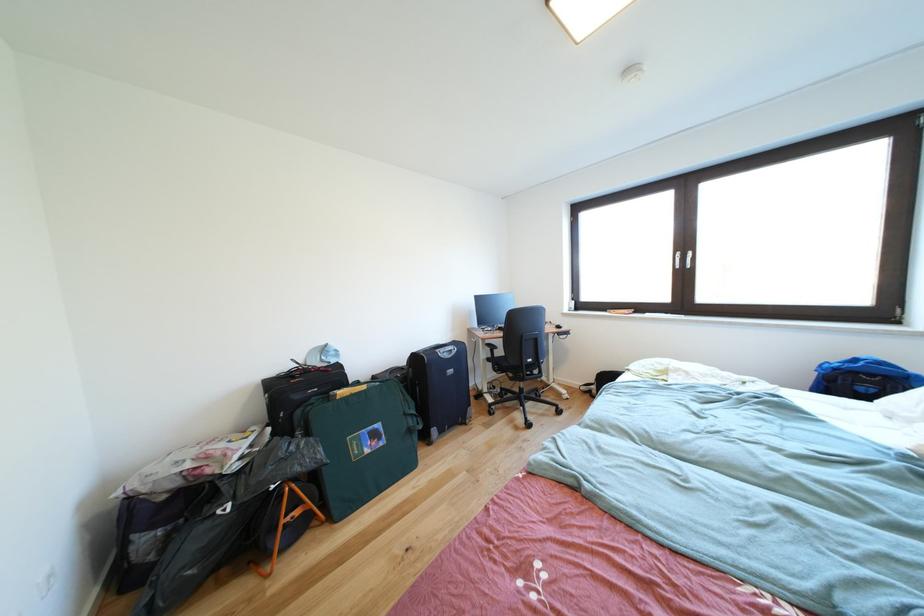
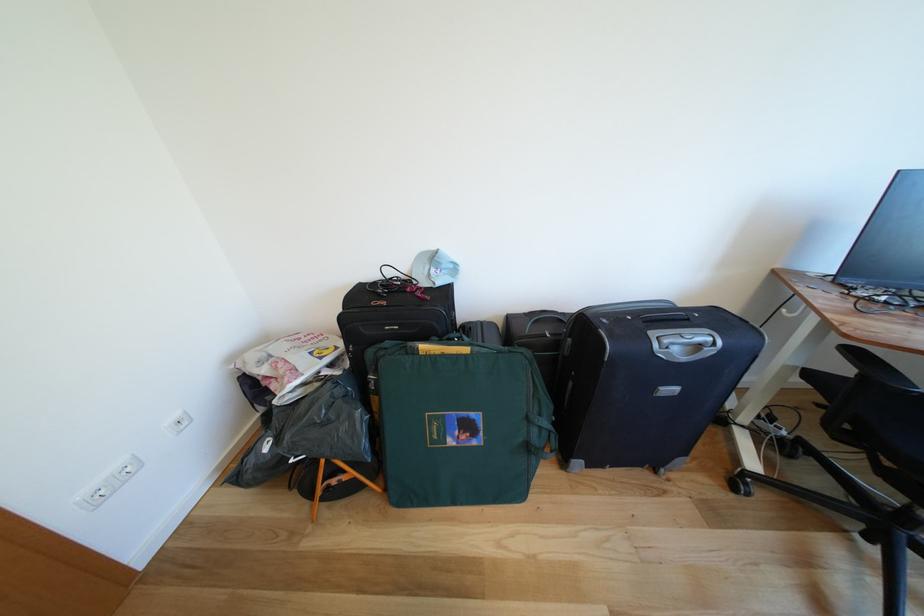
The point at (332, 354) is marked in the first image. Where is the corresponding point in the second image?

(442, 262)